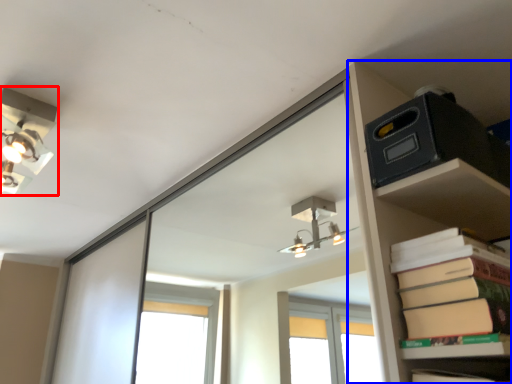
Question: Which of the following is the farthest to the observer, lamp (highlighted by a red box) or shelf (highlighted by a blue box)?

Choices:
 (A) lamp
 (B) shelf

Answer: (A)